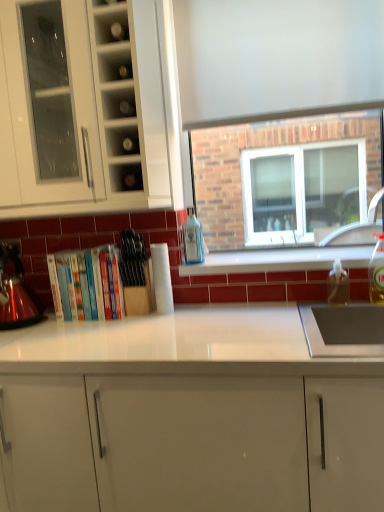
Identify the location of blank space situated above white glossy cabinet at center, placed as the 2th cabinetry when sorted from top to bottom (from a real-world perspective). (162, 329).